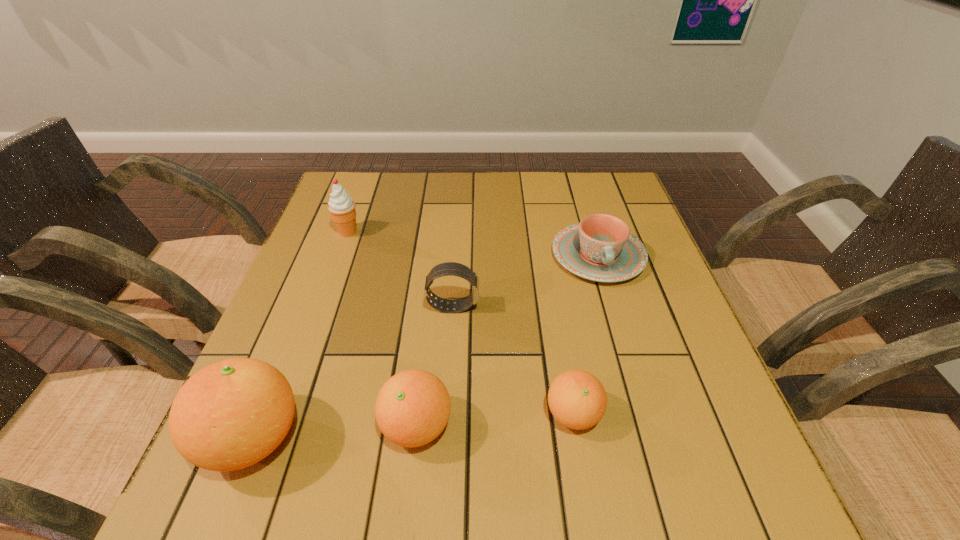
Locate an element on the screen. The image size is (960, 540). vacant spot to place a orange on the right is located at coordinates (723, 402).